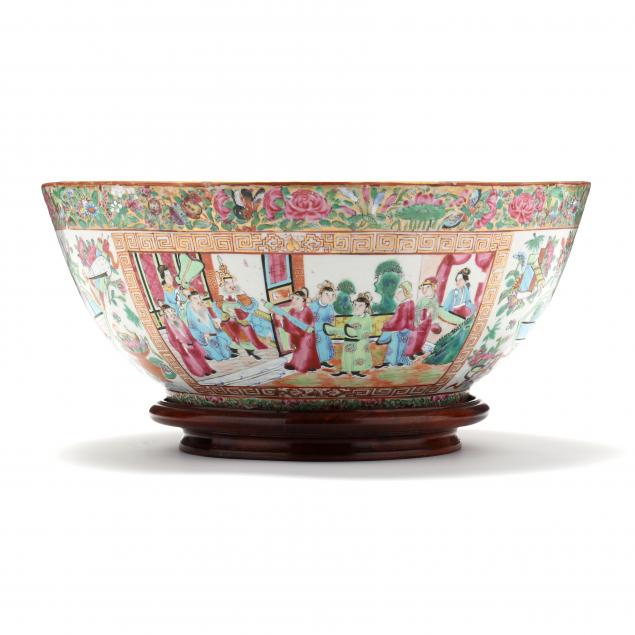
Identify the location of wall. The height and width of the screenshot is (635, 635). (336, 272).